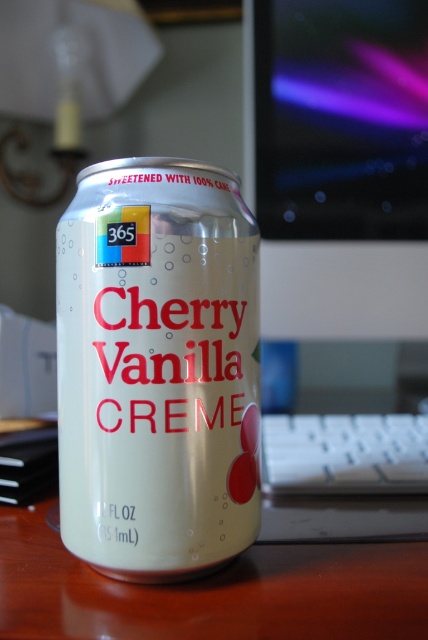
Question: Is white matte can at center bigger than glossy plastic monitor at upper center?

Choices:
 (A) yes
 (B) no

Answer: (A)

Question: Among these points, which one is farthest from the camera?

Choices:
 (A) (171, 541)
 (B) (320, 72)

Answer: (B)

Question: Can you confirm if white matte can at center is thinner than glossy plastic monitor at upper center?

Choices:
 (A) yes
 (B) no

Answer: (A)

Question: Does white matte can at center appear on the left side of glossy plastic monitor at upper center?

Choices:
 (A) no
 (B) yes

Answer: (B)

Question: Which point is closer to the camera?

Choices:
 (A) (293, 20)
 (B) (106, 531)

Answer: (B)

Question: Which point appears closest to the camera in this image?

Choices:
 (A) (371, 176)
 (B) (184, 534)

Answer: (B)